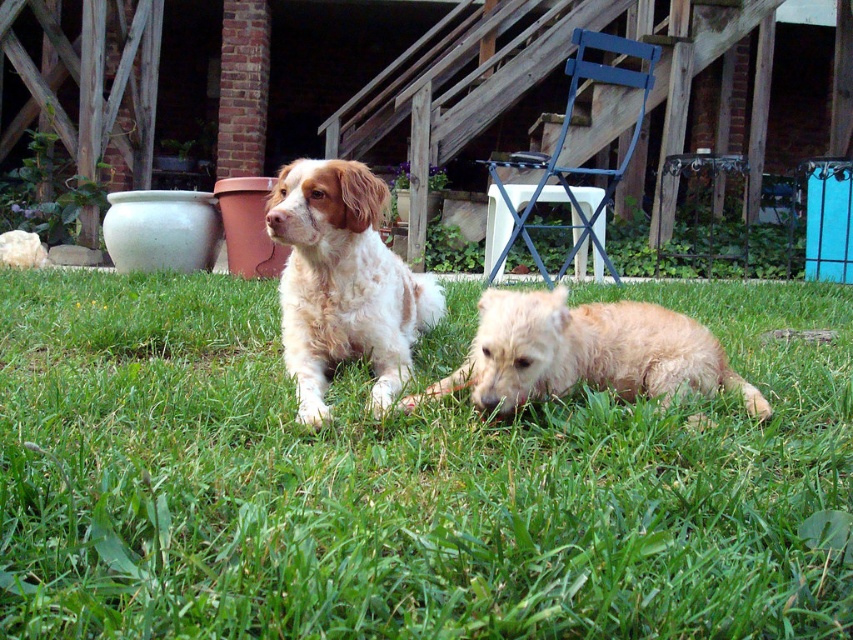
You are a dog owner who wants to ensure your fuzzy golden dog at lower center stays on the grass. Based on the scene, is the green grass at center a suitable spot for the dog to rest?

The green grass at center is below the fuzzy golden dog at lower center, so the dog can rest there comfortably as it is positioned over the grass.

You are a gardener who wants to mow the green grass at center. However, the light brown fur dog at center is currently in the way. Can you mow the grass without moving the dog?

The green grass at center is shorter than the light brown fur dog at center, so the dog is taller than the grass. Since the dog is already taller, you can mow the grass without moving it as the mower should be able to cut the shorter grass while avoiding the dog.

You are a dog owner who wants to choose a dog to walk first. The light brown fur dog at center and the fuzzy golden dog at lower center are both eager to go. Based on their sizes, which dog might be more challenging to handle due to its size?

The light brown fur dog at center has a larger size compared to the fuzzy golden dog at lower center, so it might be more challenging to handle due to its size.